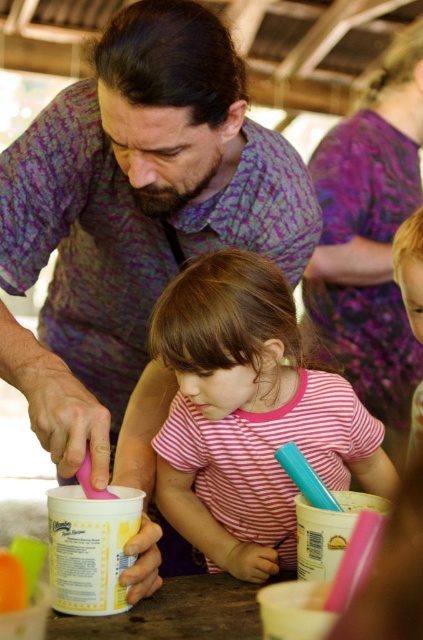
You are a photographer at the event and need to position a microphone stand between the pink striped shirt at center and the purple batik shirt at upper center. Since the stand requires 15 cm of space, will there be enough room between them based on their widths?

The pink striped shirt at center has a lesser width compared to purple batik shirt at upper center. Since the pink striped shirt at center is narrower, there should be sufficient space between them to accommodate the microphone stand requiring 15 cm.

You are at a gathering and want to introduce yourself to the person with the pink striped shirt at center. Which direction should you look relative to the blonde hair at upper right?

The pink striped shirt at center is below the blonde hair at upper right, so you should look downward from the blonde hair at upper right to find the pink striped shirt at center.